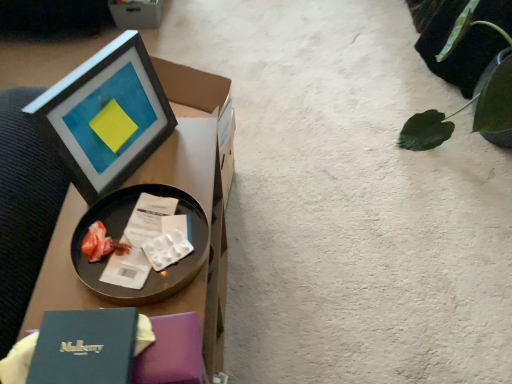
Where is `free spot to the right of matte black picture frame at upper left`? The image size is (512, 384). free spot to the right of matte black picture frame at upper left is located at coordinates (181, 161).